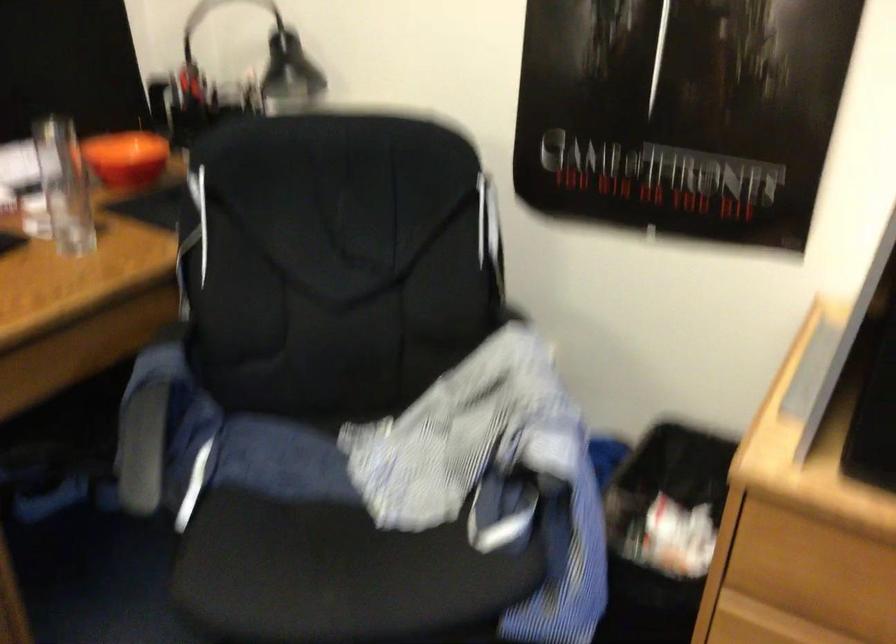
Where would you sit the chair sitting surface? Please return your answer as a coordinate pair (x, y).

(337, 574)